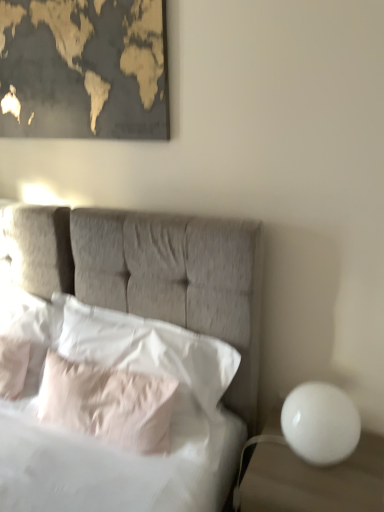
Question: From the image's perspective, is white glossy sphere at right below gold-toned matte map at upper left?

Choices:
 (A) yes
 (B) no

Answer: (A)

Question: Does white glossy sphere at right touch gold-toned matte map at upper left?

Choices:
 (A) no
 (B) yes

Answer: (A)

Question: From a real-world perspective, does white glossy sphere at right sit lower than gold-toned matte map at upper left?

Choices:
 (A) no
 (B) yes

Answer: (B)

Question: Can you confirm if white glossy sphere at right is smaller than gold-toned matte map at upper left?

Choices:
 (A) no
 (B) yes

Answer: (B)

Question: Is white glossy sphere at right outside gold-toned matte map at upper left?

Choices:
 (A) no
 (B) yes

Answer: (B)

Question: Is point (x=3, y=344) closer or farther from the camera than point (x=331, y=451)?

Choices:
 (A) closer
 (B) farther

Answer: (B)

Question: From the image's perspective, is white soft pillow at left, which ranks as the second pillow in left-to-right order, located above or below white glossy sphere at right?

Choices:
 (A) above
 (B) below

Answer: (A)

Question: Looking at their shapes, would you say white soft pillow at left, which appears as the 3th pillow when viewed from the right, is wider or thinner than white glossy sphere at right?

Choices:
 (A) thin
 (B) wide

Answer: (A)

Question: Is white soft pillow at left, which appears as the 3th pillow when viewed from the right, bigger or smaller than white glossy sphere at right?

Choices:
 (A) small
 (B) big

Answer: (A)

Question: Considering the positions of pale pink fabric pillow at center, which is counted as the third pillow, starting from the left, and white soft pillow at center, the 1th pillow viewed from the right, in the image, is pale pink fabric pillow at center, which is counted as the third pillow, starting from the left, bigger or smaller than white soft pillow at center, the 1th pillow viewed from the right,?

Choices:
 (A) small
 (B) big

Answer: (A)

Question: Which is correct: pale pink fabric pillow at center, which is counted as the third pillow, starting from the left, is inside white soft pillow at center, the 1th pillow viewed from the right, or outside of it?

Choices:
 (A) inside
 (B) outside

Answer: (A)

Question: In the image, is pale pink fabric pillow at center, which is counted as the third pillow, starting from the left, on the left side or the right side of white soft pillow at center, the 1th pillow viewed from the right?

Choices:
 (A) left
 (B) right

Answer: (A)

Question: Relative to white soft pillow at center, the 1th pillow viewed from the right, is pale pink fabric pillow at center, the second pillow when ordered from right to left, in front or behind?

Choices:
 (A) front
 (B) behind

Answer: (B)

Question: From a real-world perspective, is white soft pillow at left, which appears as the 3th pillow when viewed from the right, physically located above or below white glossy sphere at right?

Choices:
 (A) above
 (B) below

Answer: (A)

Question: In the image, is white soft pillow at left, which appears as the 3th pillow when viewed from the right, positioned in front of or behind white glossy sphere at right?

Choices:
 (A) behind
 (B) front

Answer: (A)